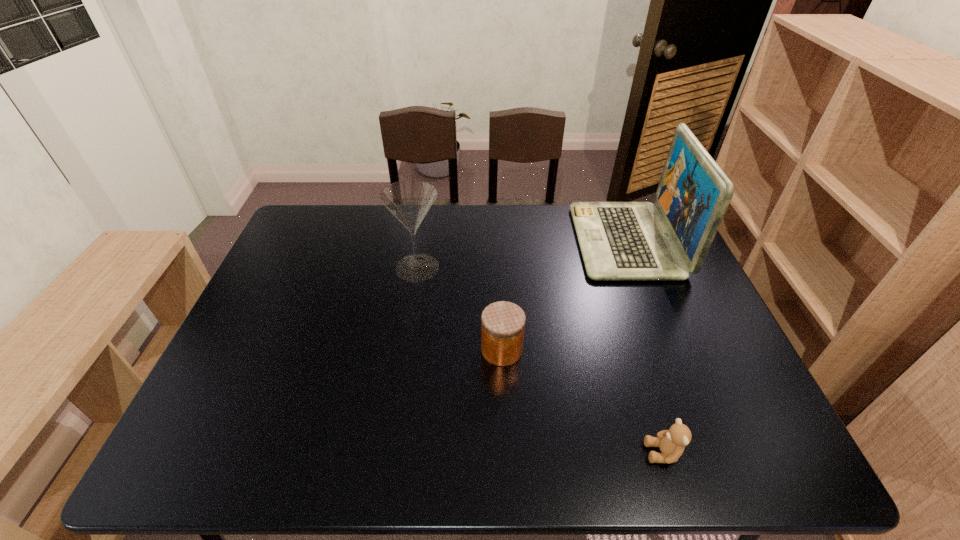
Find the location of `the tallest object`. the tallest object is located at coordinates (618, 240).

Find the location of a particular element. This screenshot has height=540, width=960. the second tallest object is located at coordinates (409, 201).

In order to click on flute glass in this screenshot , I will do `click(409, 201)`.

Identify the location of jar. (503, 323).

This screenshot has width=960, height=540. Identify the location of the second nearest object. (503, 323).

What are the coordinates of `teddy bear` in the screenshot? It's located at (672, 442).

Where is `the nearest object`? The width and height of the screenshot is (960, 540). the nearest object is located at coordinates (672, 442).

Locate an element on the screen. vacant space located on the screen of the laptop computer is located at coordinates (505, 241).

Identify the location of free region located 0.220m on the screen of the laptop computer. This screenshot has width=960, height=540. (511, 241).

Locate an element on the screen. This screenshot has height=540, width=960. free space located on the screen of the laptop computer is located at coordinates (526, 241).